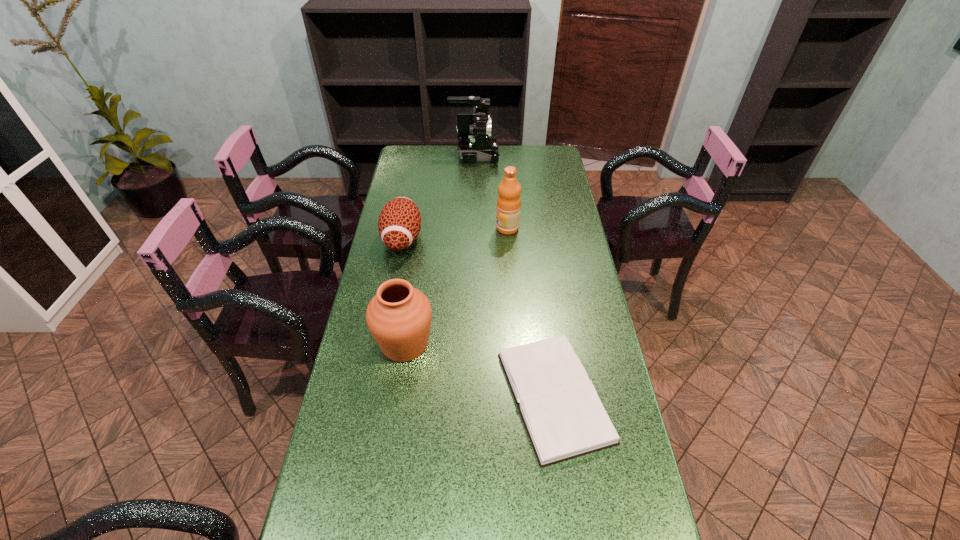
Find the location of a particular element. Image resolution: width=960 pixels, height=540 pixels. the farthest object is located at coordinates (475, 142).

Image resolution: width=960 pixels, height=540 pixels. What are the coordinates of `fruit juice` in the screenshot? It's located at (508, 202).

Find the location of a particular element. Image resolution: width=960 pixels, height=540 pixels. urn is located at coordinates (399, 316).

The height and width of the screenshot is (540, 960). I want to click on the fourth tallest object, so click(399, 224).

Where is `hardback book`? This screenshot has height=540, width=960. hardback book is located at coordinates (564, 418).

Image resolution: width=960 pixels, height=540 pixels. Identify the location of free location located 0.070m on the lens mount of the farthest object. (514, 155).

This screenshot has height=540, width=960. I want to click on free spot located on the label side of the fruit juice, so click(x=403, y=228).

Locate an element on the screen. The width and height of the screenshot is (960, 540). vacant space located 0.240m on the label side of the fruit juice is located at coordinates (433, 228).

At what (x,y) coordinates should I click in order to perform the action: click on blank area located 0.300m on the label side of the fruit juice. Please return your answer as a coordinate pair (x, y). The image size is (960, 540). Looking at the image, I should click on (x=417, y=228).

Where is `vacant region located on the right of the urn`? This screenshot has height=540, width=960. vacant region located on the right of the urn is located at coordinates (503, 344).